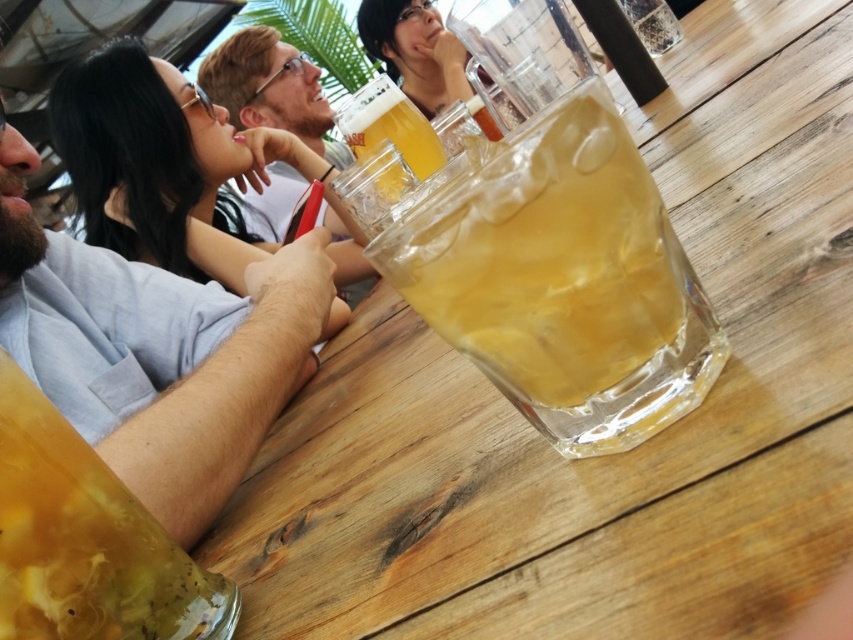
You are standing at the center of the image and want to place a new object at the same 2D location as the translucent glass at center. What are the coordinates you should aim for?

The coordinates for the translucent glass at center are at point (544, 259).

You are at an outdoor cafe and want to place a small napkin between the translucent glass at center and the matte white shirt at upper center. Which object requires more space horizontally to accommodate the napkin?

The translucent glass at center is thinner than the matte white shirt at upper center, so the matte white shirt at upper center requires more horizontal space for the napkin.

You are a server at the outdoor cafe and need to deliver a drink to the customer wearing the matte white shirt at upper center. The drink is currently in the translucent glass mug at center. Can you reach the customer without moving the mug? The minimum reach distance for the server is 1.2 meters.

The distance between the matte white shirt at upper center and the translucent glass mug at center is 1.24 meters, which is just within the server reach distance of 1.2 meters. The server can reach the customer without moving the mug.